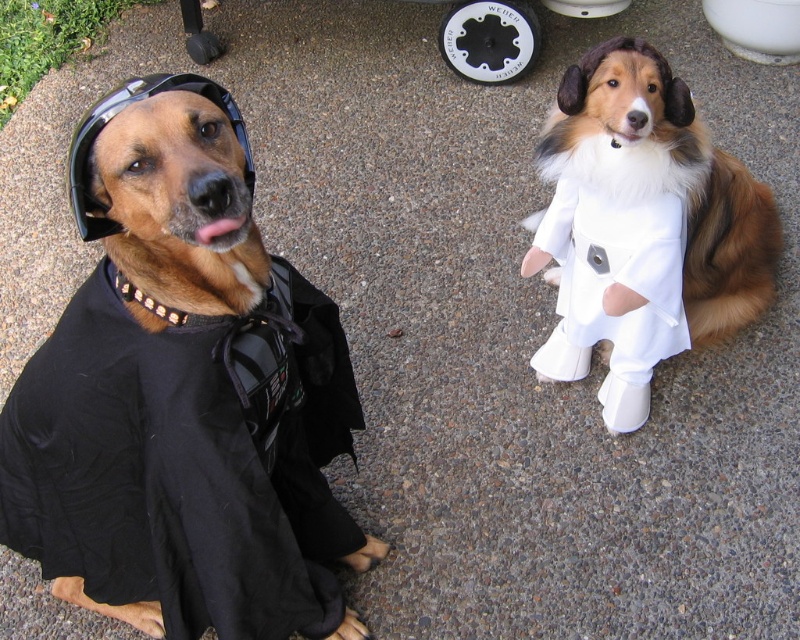
Question: Does black matte shirt at left have a greater width compared to white fur dress at right?

Choices:
 (A) yes
 (B) no

Answer: (B)

Question: Which point appears closest to the camera in this image?

Choices:
 (A) pos(64,440)
 (B) pos(628,344)

Answer: (A)

Question: Does black matte shirt at left have a greater width compared to white fur dress at right?

Choices:
 (A) yes
 (B) no

Answer: (B)

Question: Which object appears closest to the camera in this image?

Choices:
 (A) white fur dress at right
 (B) black matte shirt at left

Answer: (B)

Question: Where is black matte shirt at left located in relation to white fur dress at right in the image?

Choices:
 (A) left
 (B) right

Answer: (A)